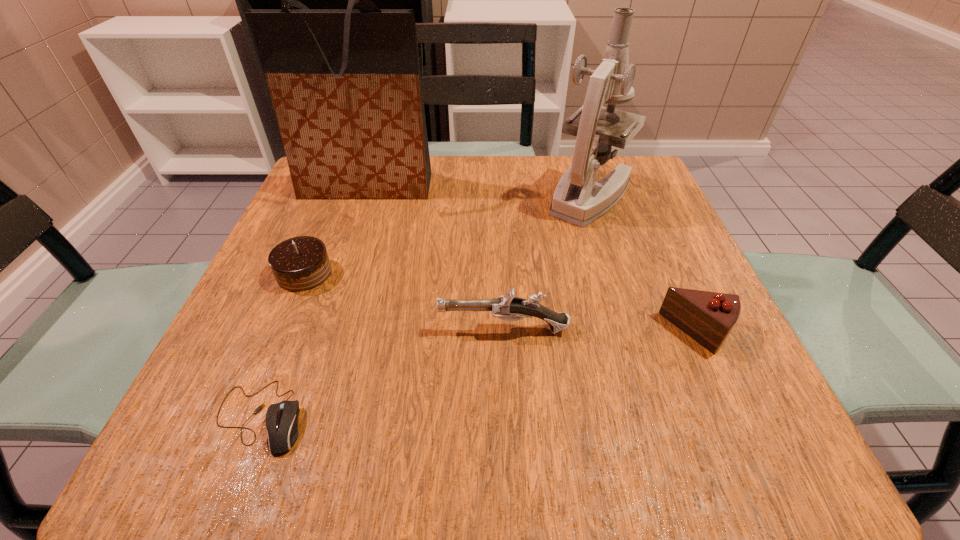
Where is `chocolate cake present at the left edge`? chocolate cake present at the left edge is located at coordinates (301, 263).

Find the location of a particular element. Image resolution: width=960 pixels, height=540 pixels. computer mouse at the left edge is located at coordinates click(x=281, y=419).

You are a GUI agent. You are given a task and a screenshot of the screen. Output one action in this format:
    pyautogui.click(x=<x>, y=<y>)
    Task: Click on the microscope that is at the right edge
    
    Given the screenshot: What is the action you would take?
    pyautogui.click(x=578, y=199)

Identify the location of chocolate cake situated at the right edge. Image resolution: width=960 pixels, height=540 pixels. (708, 317).

Find the location of a particular element. object that is at the far left corner is located at coordinates (346, 87).

Where is `object at the near left corner`? Image resolution: width=960 pixels, height=540 pixels. object at the near left corner is located at coordinates (281, 419).

The height and width of the screenshot is (540, 960). I want to click on object that is at the far right corner, so click(x=578, y=199).

Locate an element on the screen. Image resolution: width=960 pixels, height=540 pixels. vacant space at the far edge is located at coordinates (471, 161).

This screenshot has height=540, width=960. In the image, there is a desktop. In order to click on vacant space at the left edge in this screenshot , I will do `click(284, 237)`.

You are a GUI agent. You are given a task and a screenshot of the screen. Output one action in this format:
    pyautogui.click(x=<x>, y=<y>)
    Task: Click on the vacant area at the right edge of the desktop
    
    Given the screenshot: What is the action you would take?
    pyautogui.click(x=633, y=247)